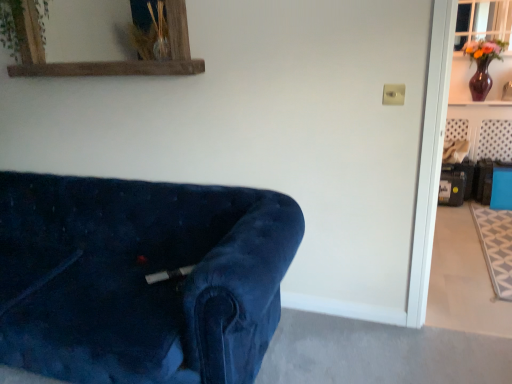
Describe the element at coordinates (460, 81) in the screenshot. I see `matte purple vase at upper right` at that location.

What is the approximate width of green leafy plant at upper left?

7.85 inches.

Describe the element at coordinates (141, 278) in the screenshot. I see `velvet blue couch at lower left` at that location.

The width and height of the screenshot is (512, 384). In order to click on matte purple vase at upper right in this screenshot , I will do `click(460, 81)`.

The height and width of the screenshot is (384, 512). I want to click on studio couch that appears below the green leafy plant at upper left (from a real-world perspective), so click(141, 278).

Is velvet blue couch at lower left at the back of green leafy plant at upper left?

That's not correct — green leafy plant at upper left is not looking away from velvet blue couch at lower left.

Which of these two, green leafy plant at upper left or velvet blue couch at lower left, is thinner?

With smaller width is green leafy plant at upper left.

Considering their positions, is rustic wood mirror at upper left located in front of or behind matte purple vase at upper right?

In the image, rustic wood mirror at upper left appears in front of matte purple vase at upper right.

Locate an element on the screen. Image resolution: width=512 pixels, height=384 pixels. mirror located on the left of matte purple vase at upper right is located at coordinates (106, 61).

Can you tell me how much rustic wood mirror at upper left and matte purple vase at upper right differ in facing direction?

The facing directions of rustic wood mirror at upper left and matte purple vase at upper right are 0.745 degrees apart.

Who is smaller, rustic wood mirror at upper left or matte purple vase at upper right?

matte purple vase at upper right is smaller.

I want to click on mirror on the right of green leafy plant at upper left, so click(106, 61).

Could green leafy plant at upper left be considered to be inside rustic wood mirror at upper left?

Indeed, green leafy plant at upper left is located within rustic wood mirror at upper left.

Which of these two, rustic wood mirror at upper left or green leafy plant at upper left, stands shorter?

Standing shorter between the two is green leafy plant at upper left.

Is rustic wood mirror at upper left facing towards green leafy plant at upper left?

Yes, rustic wood mirror at upper left is facing green leafy plant at upper left.

From the image's perspective, would you say velvet blue couch at lower left is shown under rustic wood mirror at upper left?

Yes, from the image's perspective, velvet blue couch at lower left is below rustic wood mirror at upper left.

Would you say velvet blue couch at lower left is inside or outside rustic wood mirror at upper left?

velvet blue couch at lower left is not inside rustic wood mirror at upper left, it's outside.

Where is `mirror behind the velvet blue couch at lower left`? The height and width of the screenshot is (384, 512). mirror behind the velvet blue couch at lower left is located at coordinates (106, 61).

From a real-world perspective, is green leafy plant at upper left located higher than matte purple vase at upper right?

Indeed, from a real-world perspective, green leafy plant at upper left stands above matte purple vase at upper right.

How different are the orientations of green leafy plant at upper left and matte purple vase at upper right in degrees?

The angle between the facing direction of green leafy plant at upper left and the facing direction of matte purple vase at upper right is 0.666 degrees.

From the image's perspective, does green leafy plant at upper left appear higher than matte purple vase at upper right?

No, from the image's perspective, green leafy plant at upper left is not on top of matte purple vase at upper right.

From the image's perspective, which one is positioned higher, green leafy plant at upper left or clear glass window at upper right?

clear glass window at upper right is shown above in the image.

From a real-world perspective, is green leafy plant at upper left located higher than clear glass window at upper right?

Yes, from a real-world perspective, green leafy plant at upper left is above clear glass window at upper right.

The image size is (512, 384). I want to click on plant on the left of clear glass window at upper right, so click(11, 27).

Based on the photo, is green leafy plant at upper left positioned with its back to clear glass window at upper right?

No, green leafy plant at upper left is not facing the opposite direction of clear glass window at upper right.

Can you confirm if clear glass window at upper right is thinner than matte purple vase at upper right?

Yes, clear glass window at upper right is thinner than matte purple vase at upper right.

How different are the orientations of clear glass window at upper right and matte purple vase at upper right in degrees?

clear glass window at upper right and matte purple vase at upper right are facing 1.85 degrees away from each other.

Can you confirm if clear glass window at upper right is positioned to the left of matte purple vase at upper right?

No.

From the image's perspective, is clear glass window at upper right positioned above or below matte purple vase at upper right?

clear glass window at upper right is situated higher than matte purple vase at upper right in the image.

Locate an element on the screen. studio couch on the right of green leafy plant at upper left is located at coordinates (141, 278).

At what (x,y) coordinates should I click in order to perform the action: click on shelf lying behind the rustic wood mirror at upper left. Please return your answer as a coordinate pair (x, y). This screenshot has height=384, width=512. Looking at the image, I should click on (460, 81).

From the image, which object appears to be farther from matte purple vase at upper right, velvet blue couch at lower left or rustic wood mirror at upper left?

velvet blue couch at lower left.

Looking at this image, which object lies nearer to the anchor point green leafy plant at upper left, rustic wood mirror at upper left or velvet blue couch at lower left?

rustic wood mirror at upper left is positioned closer to the anchor green leafy plant at upper left.

Which object lies further to the anchor point clear glass window at upper right, green leafy plant at upper left or velvet blue couch at lower left?

Based on the image, green leafy plant at upper left appears to be further to clear glass window at upper right.

Looking at the image, which one is located further to rustic wood mirror at upper left, green leafy plant at upper left or velvet blue couch at lower left?

velvet blue couch at lower left is further to rustic wood mirror at upper left.

From the image, which object appears to be farther from green leafy plant at upper left, rustic wood mirror at upper left or clear glass window at upper right?

clear glass window at upper right lies further to green leafy plant at upper left than the other object.

Based on their spatial positions, is matte purple vase at upper right or green leafy plant at upper left closer to rustic wood mirror at upper left?

green leafy plant at upper left lies closer to rustic wood mirror at upper left than the other object.

Looking at the image, which one is located further to clear glass window at upper right, matte purple vase at upper right or green leafy plant at upper left?

green leafy plant at upper left is further to clear glass window at upper right.

From the image, which object appears to be nearer to velvet blue couch at lower left, matte purple vase at upper right or green leafy plant at upper left?

green leafy plant at upper left is positioned closer to the anchor velvet blue couch at lower left.

Image resolution: width=512 pixels, height=384 pixels. I want to click on studio couch between green leafy plant at upper left and matte purple vase at upper right from left to right, so (141, 278).

Image resolution: width=512 pixels, height=384 pixels. Find the location of `mirror between green leafy plant at upper left and velvet blue couch at lower left vertically`. mirror between green leafy plant at upper left and velvet blue couch at lower left vertically is located at coordinates (106, 61).

In order to click on mirror between green leafy plant at upper left and clear glass window at upper right from left to right in this screenshot , I will do `click(106, 61)`.

In order to click on mirror between velvet blue couch at lower left and clear glass window at upper right in this screenshot , I will do `click(106, 61)`.